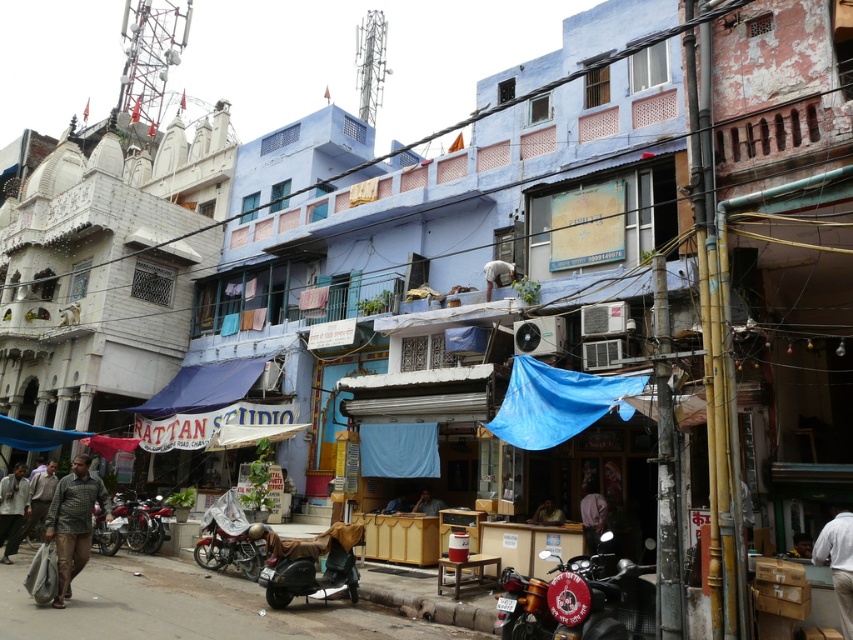
Based on the photo, who is more distant from viewer, (585, 531) or (495, 269)?

The point (495, 269) is behind.

Does dark purple fabric at center lie in front of white fabric at center?

That is True.

Is point (599, 509) positioned before point (514, 269)?

Yes, point (599, 509) is in front of point (514, 269).

Find the location of a particular element. dark purple fabric at center is located at coordinates (593, 515).

Measure the distance from metallic red motorcycle at lower center to light gray fabric pants at lower right.

They are 97.98 feet apart.

Between metallic red motorcycle at lower center and light gray fabric pants at lower right, which one appears on the left side from the viewer's perspective?

metallic red motorcycle at lower center

Measure the distance between point (244,544) and camera.

Point (244,544) is 42.26 meters from camera.

I want to click on metallic red motorcycle at lower center, so click(x=229, y=538).

Consider the image. Can you confirm if dark gray matte scooter at center is positioned to the right of light brown leather jacket at lower right?

In fact, dark gray matte scooter at center is to the left of light brown leather jacket at lower right.

Who is lower down, dark gray matte scooter at center or light brown leather jacket at lower right?

dark gray matte scooter at center is below.

Which is behind, point (341, 524) or point (801, 545)?

The point (341, 524) is behind.

The width and height of the screenshot is (853, 640). Identify the location of dark gray matte scooter at center. click(310, 564).